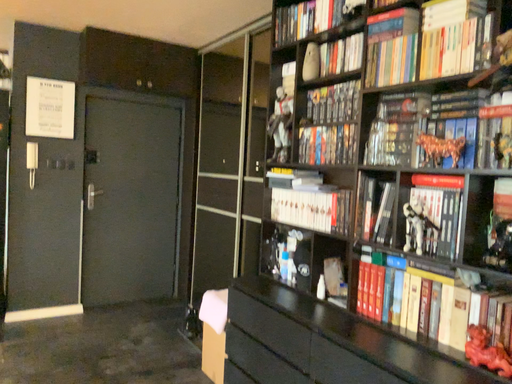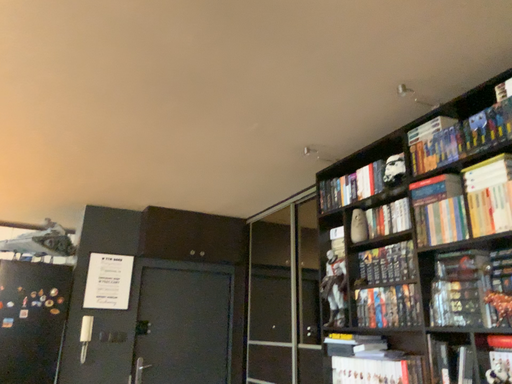
Question: How did the camera likely rotate when shooting the video?

Choices:
 (A) rotated upward
 (B) rotated downward

Answer: (A)